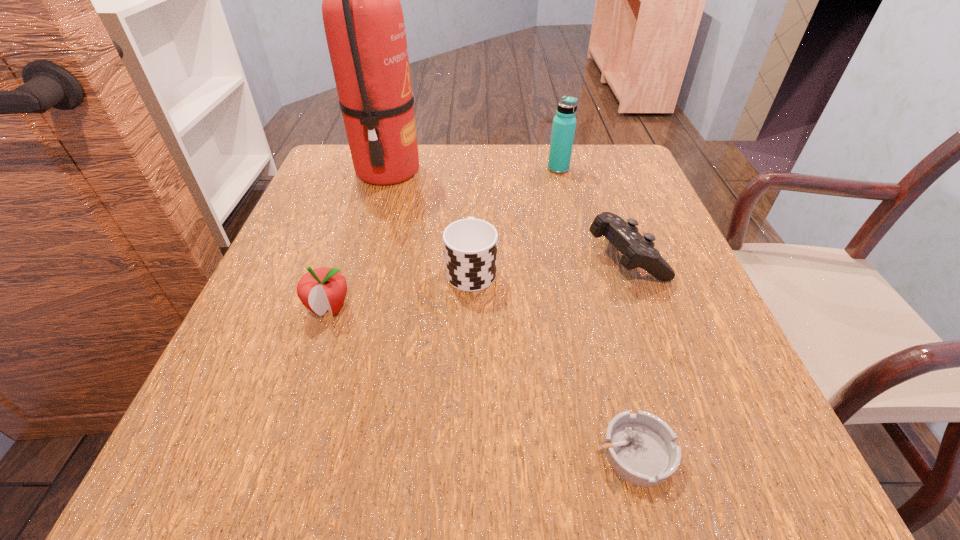
Locate which object ranks fourth in proximity to the tallest object. Please provide its 2D coordinates. Your answer should be formatted as a tuple, i.e. [(x, y)], where the tuple contains the x and y coordinates of a point satisfying the conditions above.

[(638, 251)]

Find the location of `free location that satisfies the following two spatial constraints: 1. on the side of the shortest object with the nozzle and handle; 2. on the left side of the tallest object`. free location that satisfies the following two spatial constraints: 1. on the side of the shortest object with the nozzle and handle; 2. on the left side of the tallest object is located at coordinates (306, 452).

Identify the location of vacant space that satisfies the following two spatial constraints: 1. on the side of the fire extinguisher with the nozzle and handle; 2. on the right side of the fifth tallest object. [x=363, y=257].

The width and height of the screenshot is (960, 540). I want to click on vacant space that satisfies the following two spatial constraints: 1. on the side of the fire extinguisher with the nozzle and handle; 2. on the right side of the control, so click(363, 257).

Image resolution: width=960 pixels, height=540 pixels. I want to click on vacant position in the image that satisfies the following two spatial constraints: 1. on the side of the fire extinguisher with the nozzle and handle; 2. on the side of the cup with the handle, so click(359, 268).

Find the location of a particular element. The image size is (960, 540). vacant region that satisfies the following two spatial constraints: 1. on the side of the third object from left to right with the handle; 2. on the left side of the water bottle is located at coordinates (473, 169).

This screenshot has width=960, height=540. I want to click on free location that satisfies the following two spatial constraints: 1. on the side of the cup with the handle; 2. on the right side of the control, so click(x=471, y=257).